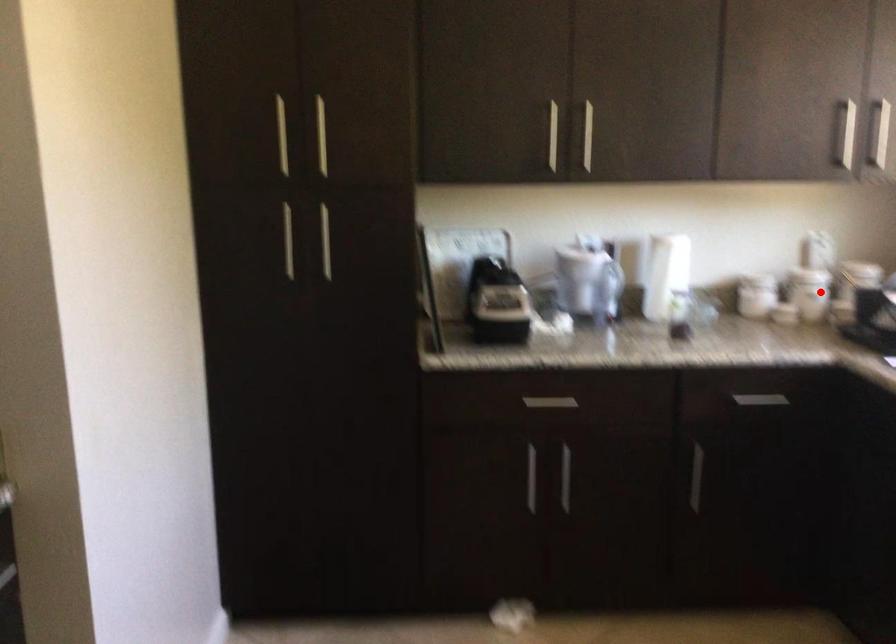
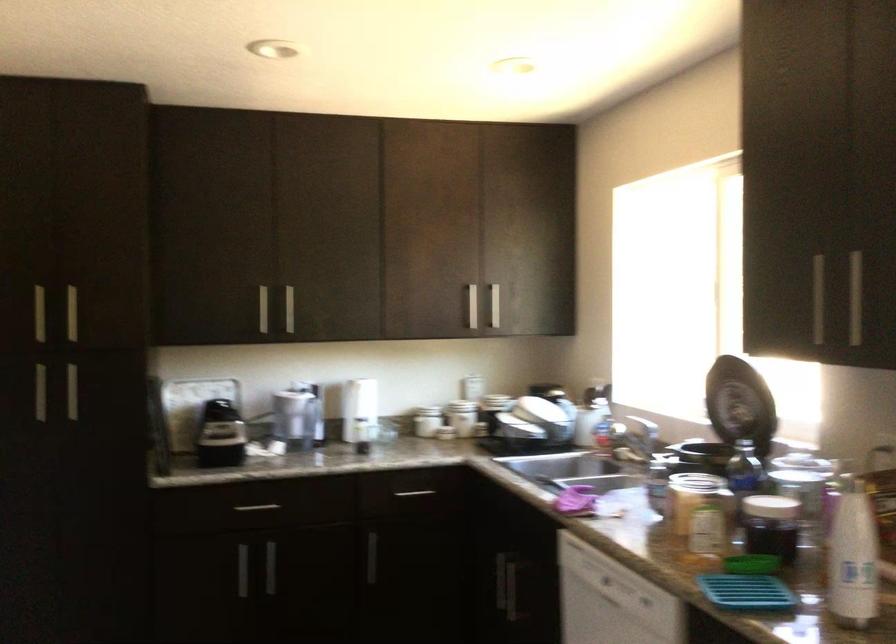
Question: I am providing you with two images of the same scene from different viewpoints. A red point is marked on the first image. Can you still see the location of the red point in image 2?

Choices:
 (A) Yes
 (B) No

Answer: (A)